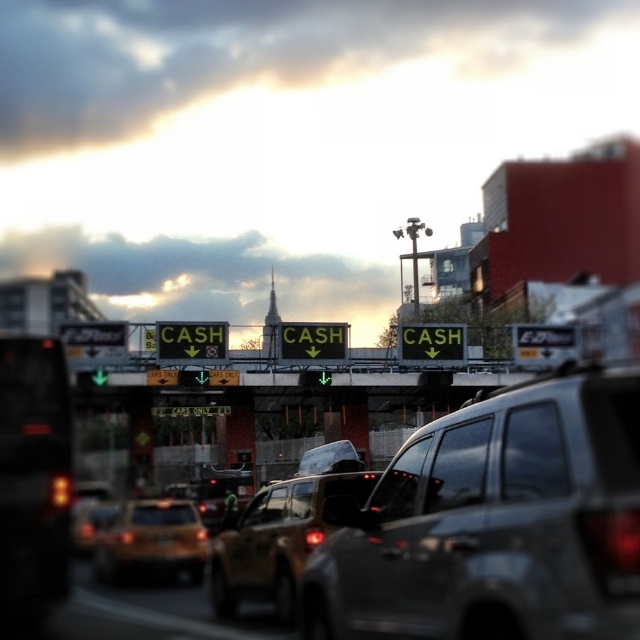
Question: Which object appears farthest from the camera in this image?

Choices:
 (A) orange matte taxi cab at center
 (B) black plastic license plate at center
 (C) matte gold suv at center
 (D) matte black suv at left

Answer: (B)

Question: Can you confirm if orange matte taxi cab at center is positioned to the left of black plastic license plate at center?

Choices:
 (A) no
 (B) yes

Answer: (B)

Question: Which object is positioned closest to the matte gold suv at center?

Choices:
 (A) black plastic license plate at center
 (B) metallic gray suv at center
 (C) orange matte taxi cab at center

Answer: (A)

Question: Which point appears closest to the camera in this image?

Choices:
 (A) (161, 538)
 (B) (266, 582)
 (C) (500, 468)

Answer: (C)

Question: Can you confirm if metallic gray suv at center is smaller than black plastic license plate at center?

Choices:
 (A) no
 (B) yes

Answer: (A)

Question: Does matte gold suv at center come behind black plastic license plate at center?

Choices:
 (A) no
 (B) yes

Answer: (A)